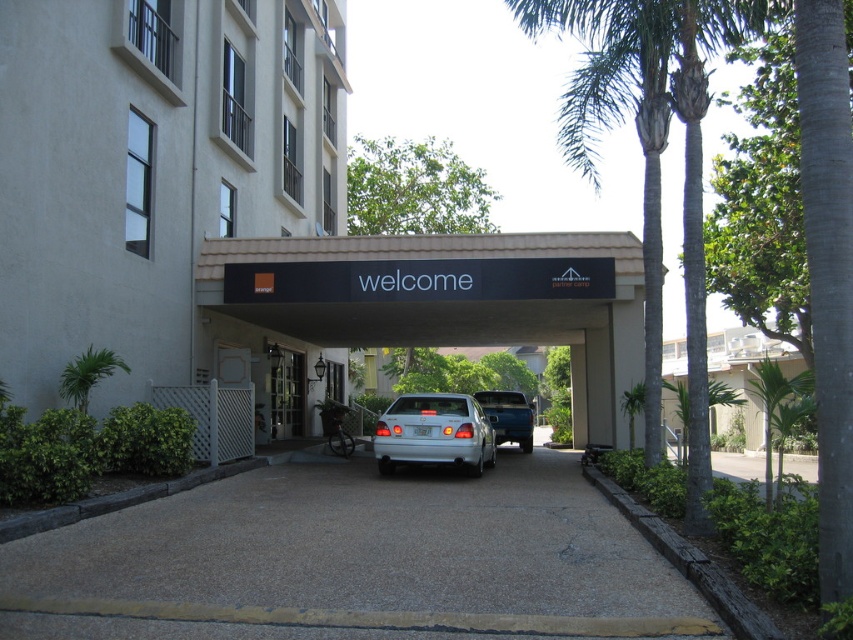
Is matte white building at center below clear glass door at center?

No.

Is matte white building at center bigger than clear glass door at center?

Yes.

Does point (39, 148) come in front of point (276, 396)?

Yes, it is.

Identify the location of matte white building at center. This screenshot has height=640, width=853. (160, 182).

Is matte white building at center below green leafy palm tree at center?

Correct, matte white building at center is located below green leafy palm tree at center.

Does matte white building at center come in front of green leafy palm tree at center?

No, matte white building at center is behind green leafy palm tree at center.

Is point (83, 276) in front of point (688, 36)?

No.

You are a GUI agent. You are given a task and a screenshot of the screen. Output one action in this format:
    pyautogui.click(x=<x>, y=<y>)
    Task: Click on the matte white building at center
    
    Given the screenshot: What is the action you would take?
    pyautogui.click(x=160, y=182)

Is matte white building at center below white concrete building at right?

No.

In the scene shown: Is matte white building at center smaller than white concrete building at right?

Yes, matte white building at center is smaller than white concrete building at right.

Is point (33, 406) closer to viewer compared to point (683, 369)?

Yes, point (33, 406) is closer to viewer.

Locate an element on the screen. This screenshot has height=640, width=853. matte white building at center is located at coordinates (160, 182).